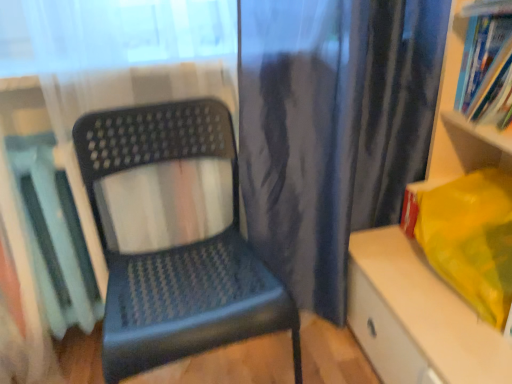
Question: From the image's perspective, is matte plastic chair at center located above or below blue paperback book at upper right, which appears as the second book when viewed from the left?

Choices:
 (A) below
 (B) above

Answer: (A)

Question: Considering the positions of point (130, 162) and point (463, 102), is point (130, 162) closer or farther from the camera than point (463, 102)?

Choices:
 (A) closer
 (B) farther

Answer: (A)

Question: Considering the real-world distances, which object is closest to the matte plastic books at upper right, the second shelf positioned from the bottom?

Choices:
 (A) matte plastic shelf at right, the 1th shelf from the bottom
 (B) blue paperback book at upper right, which is counted as the 1th book, starting from the right
 (C) matte plastic book at left, positioned as the 1th book in left-to-right order
 (D) matte plastic chair at center

Answer: (B)

Question: Which object is positioned closest to the blue paperback book at upper right, which appears as the second book when viewed from the left?

Choices:
 (A) matte plastic chair at center
 (B) matte plastic books at upper right, the first shelf in the top-to-bottom sequence
 (C) matte plastic book at left, which is the second book in top-to-bottom order
 (D) matte plastic shelf at right, the 1th shelf from the bottom

Answer: (B)